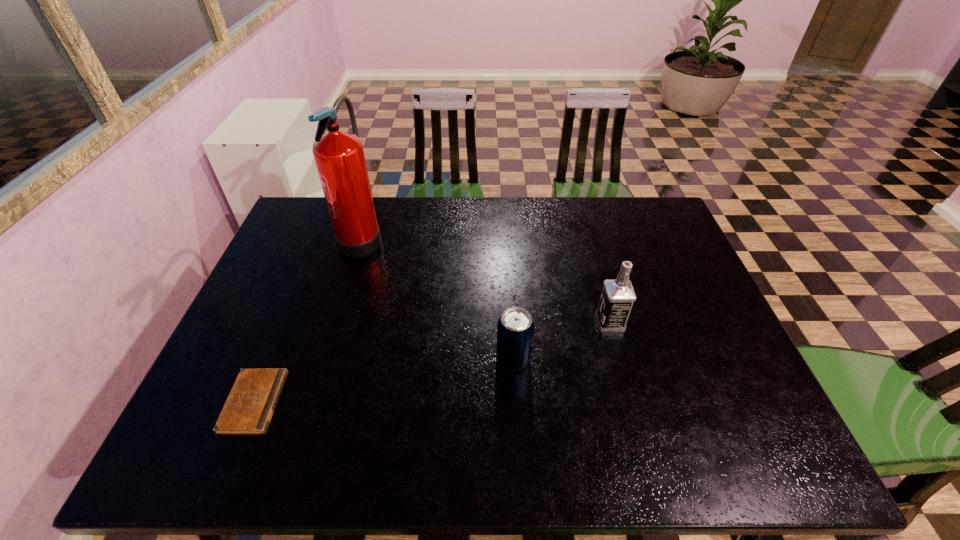
The image size is (960, 540). Find the location of `the tallest object`. the tallest object is located at coordinates (339, 156).

This screenshot has height=540, width=960. I want to click on the third object from right to left, so click(x=339, y=156).

Find the location of a particular element. the second tallest object is located at coordinates (618, 295).

Where is `the third nearest object`? This screenshot has height=540, width=960. the third nearest object is located at coordinates (618, 295).

Locate an element on the screen. soda can is located at coordinates (515, 329).

Identify the location of the second shortest object. (515, 329).

Find the location of a particular element. The image size is (960, 540). the leftmost object is located at coordinates (248, 410).

At what (x,y) coordinates should I click in order to perform the action: click on the shortest object. Please return your answer as a coordinate pair (x, y). Looking at the image, I should click on (248, 410).

At what (x,y) coordinates should I click in order to perform the action: click on free region located 0.390m on the right of the farthest object. Please return your answer as a coordinate pair (x, y). Image resolution: width=960 pixels, height=540 pixels. Looking at the image, I should click on (504, 235).

The image size is (960, 540). I want to click on free space located 0.150m on the front label of the second tallest object, so click(x=540, y=322).